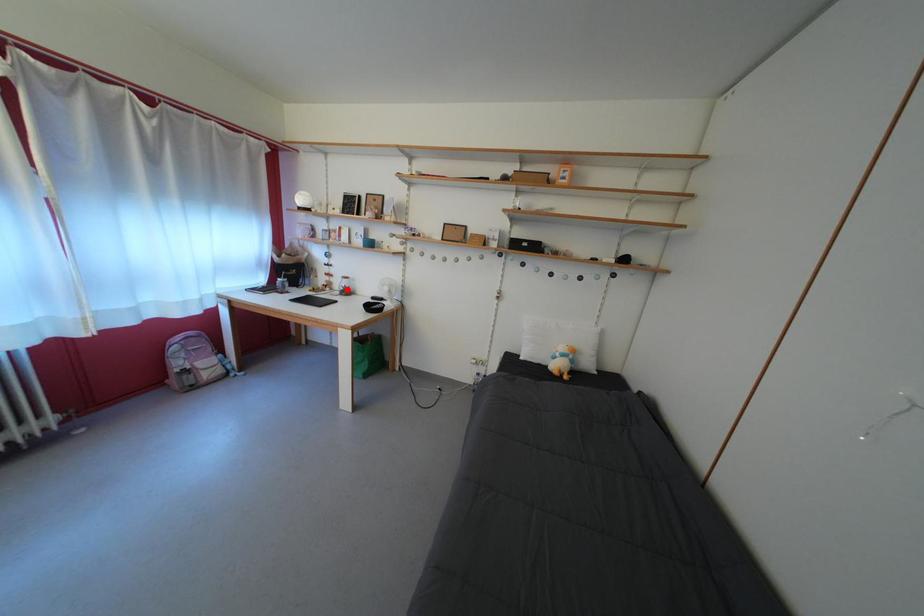
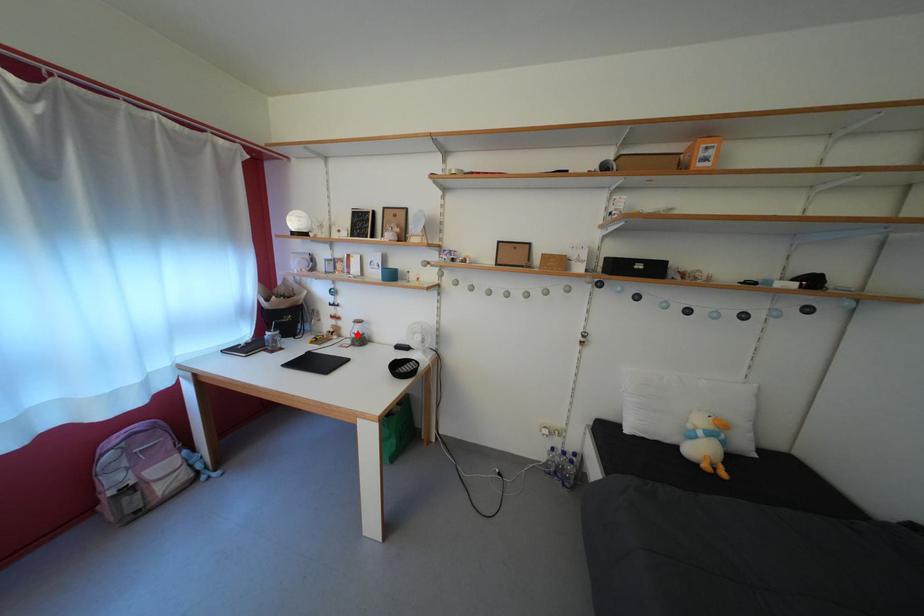
I am providing you with two images of the same scene from different viewpoints. A red point is marked on the first image and another point is marked on the second image. Does the point marked in image1 correspond to the same location as the one in image2?

Yes